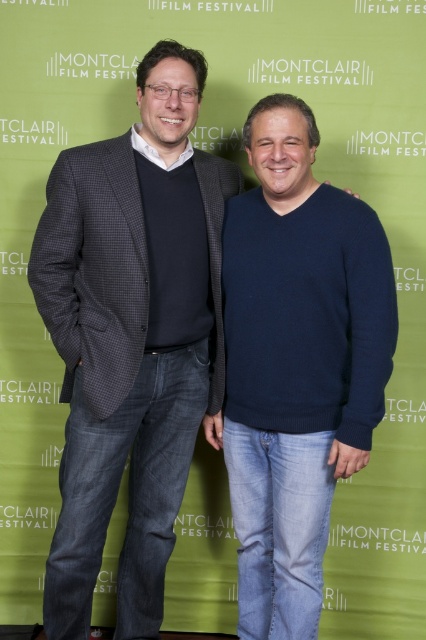
Who is higher up, dark gray textured blazer at left or dark blue sweater at center?

dark gray textured blazer at left

Is point (85, 392) more distant than point (290, 532)?

No, (85, 392) is in front of (290, 532).

In order to click on dark gray textured blazer at left in this screenshot , I will do `click(132, 337)`.